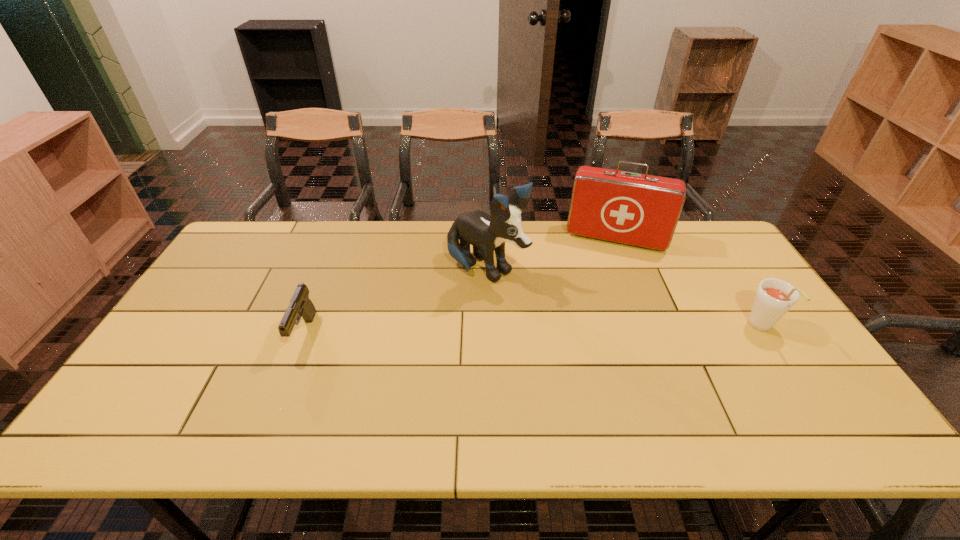
I want to click on vacant space on the desktop that is between the leftmost object and the rightmost object and is positioned on the front-facing side of the tallest object, so click(584, 330).

At what (x,y) coordinates should I click in order to perform the action: click on vacant space on the desktop that is between the leftmost object and the second shortest object and is positioned on the side of the second object from right to left with the first aid cross symbol. Please return your answer as a coordinate pair (x, y). The width and height of the screenshot is (960, 540). Looking at the image, I should click on (600, 330).